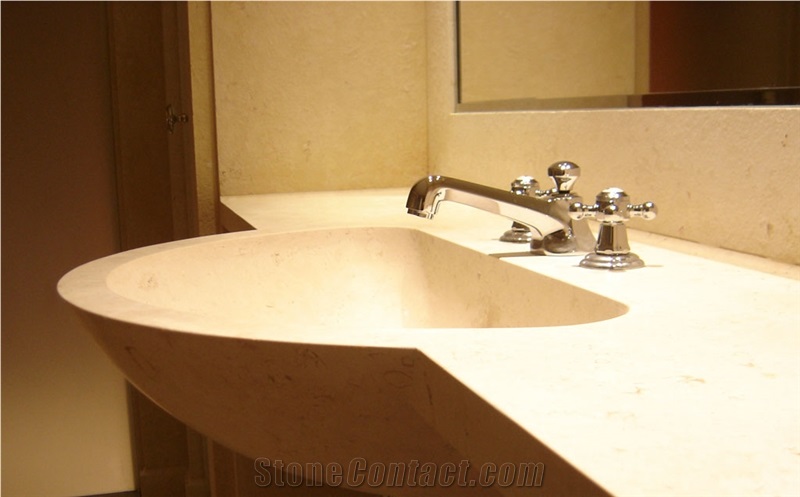
What are the coordinates of `faucet` in the screenshot? It's located at (430, 194).